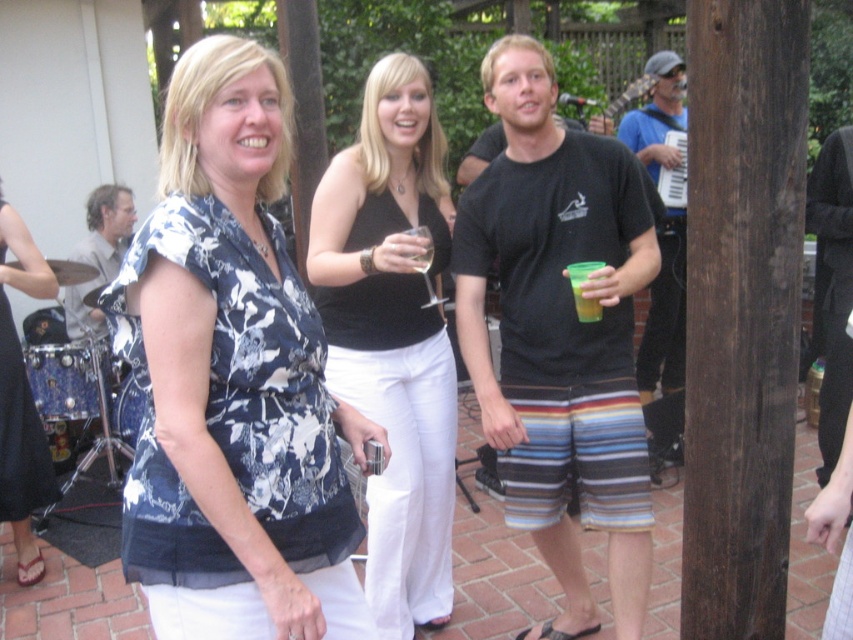
Can you confirm if matte floral blouse at center is thinner than blue fabric accordion at right?

Indeed, matte floral blouse at center has a lesser width compared to blue fabric accordion at right.

Image resolution: width=853 pixels, height=640 pixels. Describe the element at coordinates (21, 401) in the screenshot. I see `matte floral blouse at center` at that location.

Between point (10, 244) and point (682, 252), which one is positioned in front?

Positioned in front is point (10, 244).

The width and height of the screenshot is (853, 640). Identify the location of matte floral blouse at center. (21, 401).

Measure the distance between black cotton t-shirt at center and camera.

black cotton t-shirt at center is 7.00 feet from camera.

Can you confirm if black cotton t-shirt at center is taller than blue fabric accordion at right?

In fact, black cotton t-shirt at center may be shorter than blue fabric accordion at right.

Locate an element on the screen. Image resolution: width=853 pixels, height=640 pixels. black cotton t-shirt at center is located at coordinates (560, 333).

Consider the image. Who is positioned more to the left, black matte tank top at center or matte floral blouse at center?

From the viewer's perspective, matte floral blouse at center appears more on the left side.

Looking at this image, does black matte tank top at center have a larger size compared to matte floral blouse at center?

Yes.

Which is behind, point (380, 308) or point (3, 436)?

Point (3, 436)

Where is `black matte tank top at center`? The image size is (853, 640). black matte tank top at center is located at coordinates (393, 333).